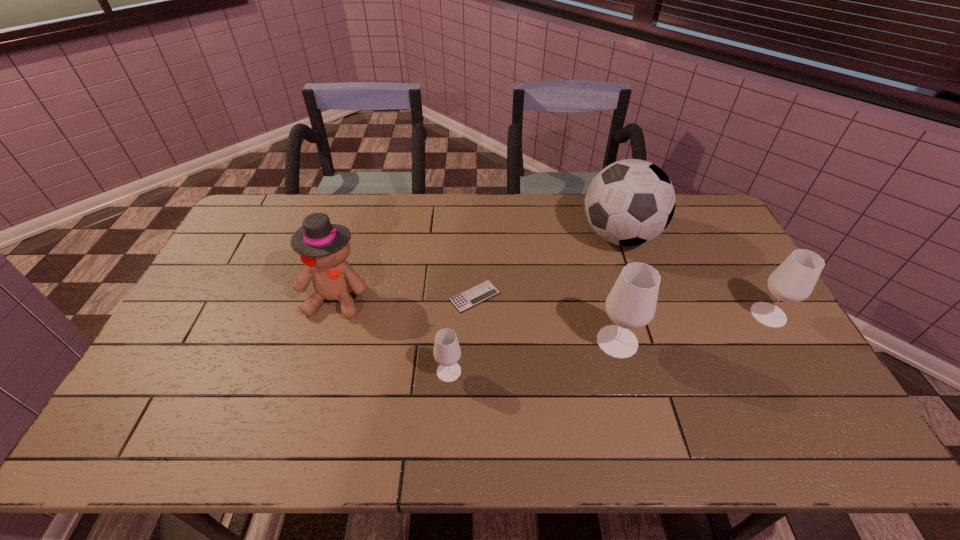
At what (x,y) coordinates should I click in order to perform the action: click on free point that keeps the glasss evenly spaced on the left. Please return your answer as a coordinate pair (x, y). Looking at the image, I should click on (260, 405).